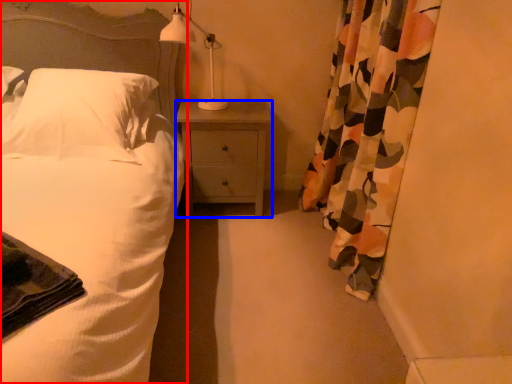
Question: Which object appears closest to the camera in this image, bed (highlighted by a red box) or nightstand (highlighted by a blue box)?

Choices:
 (A) bed
 (B) nightstand

Answer: (A)